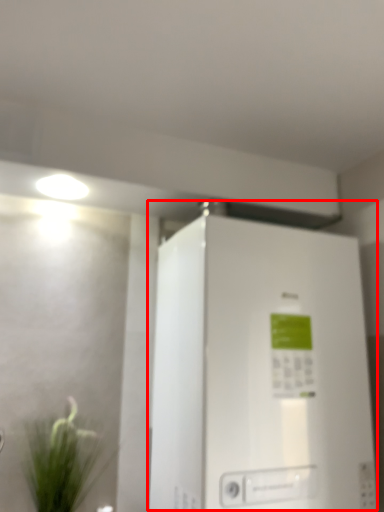
Question: In this image, where is refrigerator (annotated by the red box) located relative to houseplant?

Choices:
 (A) left
 (B) right

Answer: (B)